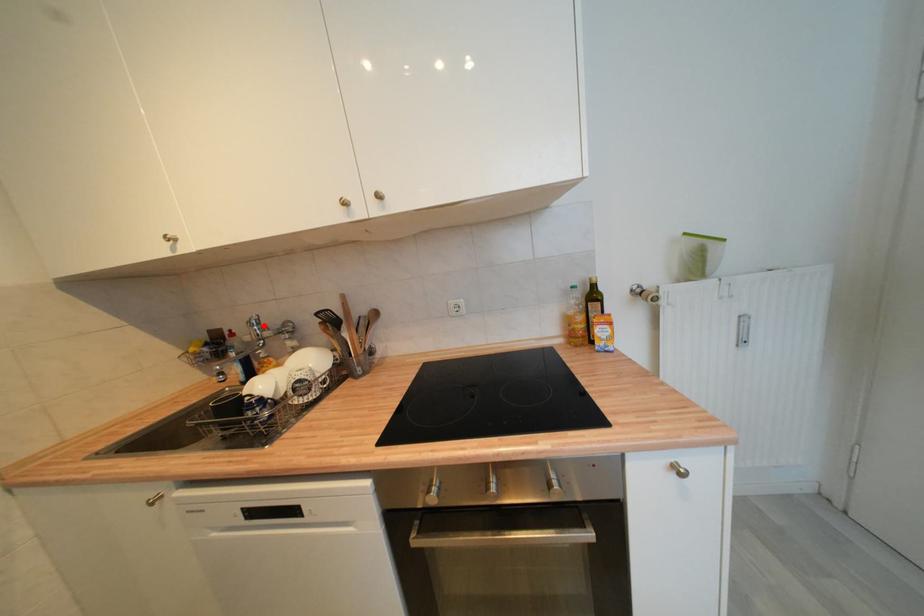
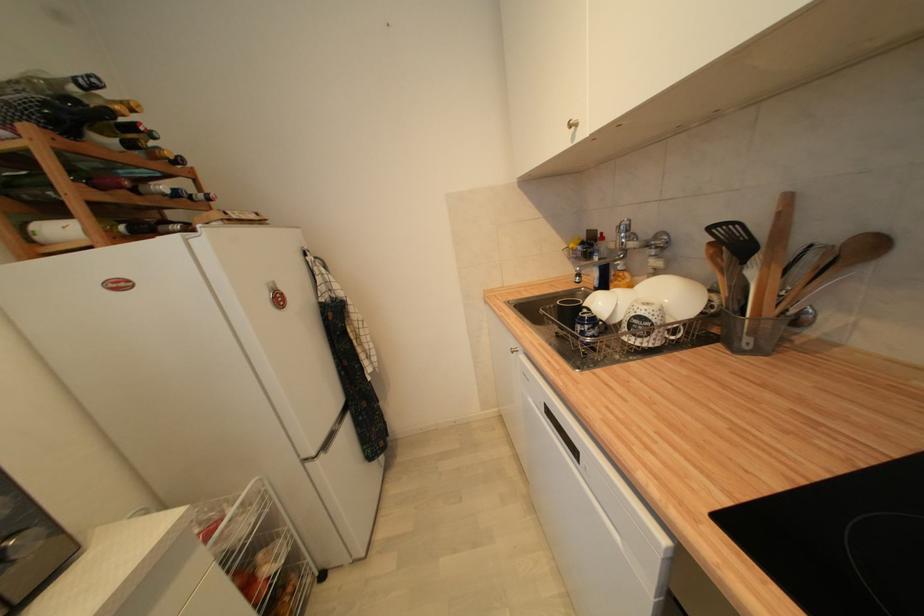
Find the pixel in the second image that matches the highlighted location in the first image.

(633, 233)